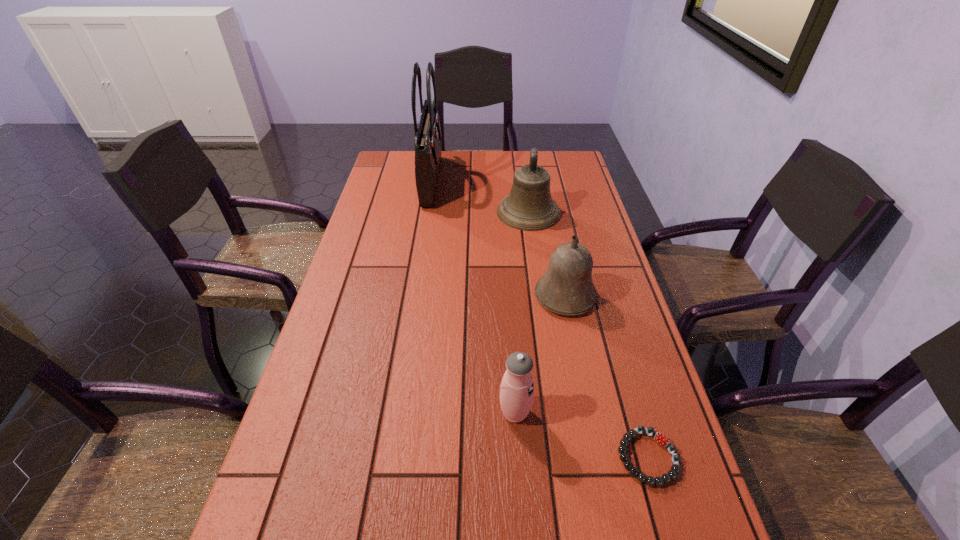
Find the location of a particular element. This screenshot has height=540, width=960. vacant area in the image that satisfies the following two spatial constraints: 1. with an open clasp on the front of the handbag; 2. on the back side of the second nearest object is located at coordinates (395, 413).

Find the location of a particular element. This screenshot has height=540, width=960. vacant space that satisfies the following two spatial constraints: 1. with an open clasp on the front of the nearest object; 2. on the left side of the leftmost object is located at coordinates (387, 457).

Where is `vacant area that satisfies the following two spatial constraints: 1. with an open clasp on the front of the handbag; 2. on the right side of the fourth farthest object`? vacant area that satisfies the following two spatial constraints: 1. with an open clasp on the front of the handbag; 2. on the right side of the fourth farthest object is located at coordinates (395, 413).

This screenshot has height=540, width=960. I want to click on vacant space that satisfies the following two spatial constraints: 1. on the back side of the second nearest object; 2. on the left side of the farther bell, so click(502, 212).

Identify the location of free location that satisfies the following two spatial constraints: 1. with an open clasp on the front of the handbag; 2. on the right side of the shorter bell. (413, 296).

Locate an element on the screen. Image resolution: width=960 pixels, height=540 pixels. free spot that satisfies the following two spatial constraints: 1. with an open clasp on the front of the handbag; 2. on the left side of the third farthest object is located at coordinates (413, 296).